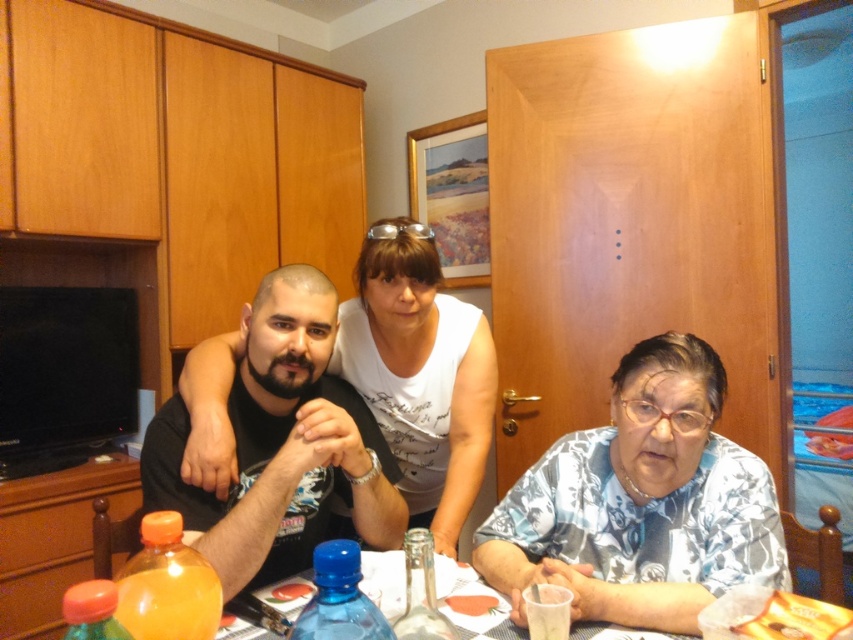
In the scene shown: You are arranging a dinner party and need to place a centerpiece on the table. The floral patterned fabric at lower right is where you want to place it. However, there is a point marked at coordinates (641, 502). Is this point located on the floral patterned fabric at lower right?

Yes, the point at coordinates (641, 502) is located on the floral patterned fabric at lower right as described.